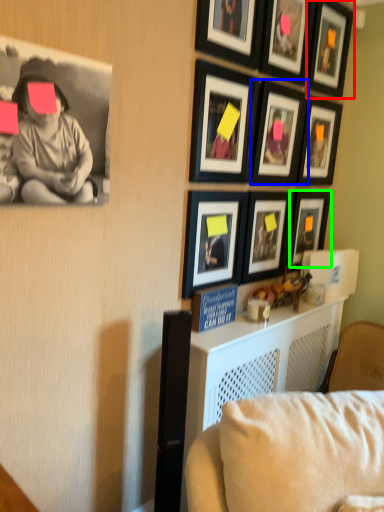
Question: Which object is the closest to the picture frame (highlighted by a red box)? Choose among these: picture frame (highlighted by a blue box) or picture frame (highlighted by a green box).

Choices:
 (A) picture frame
 (B) picture frame

Answer: (A)